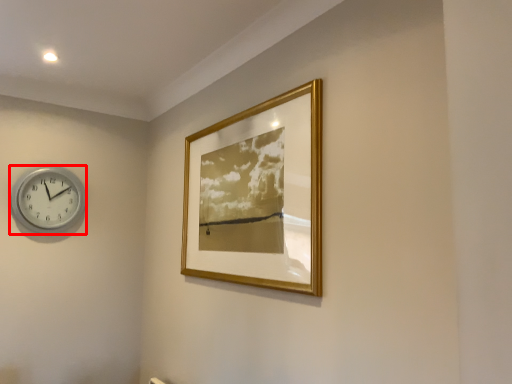
Question: Observing the image, what is the correct spatial positioning of wall clock (annotated by the red box) in reference to picture frame?

Choices:
 (A) left
 (B) right

Answer: (A)